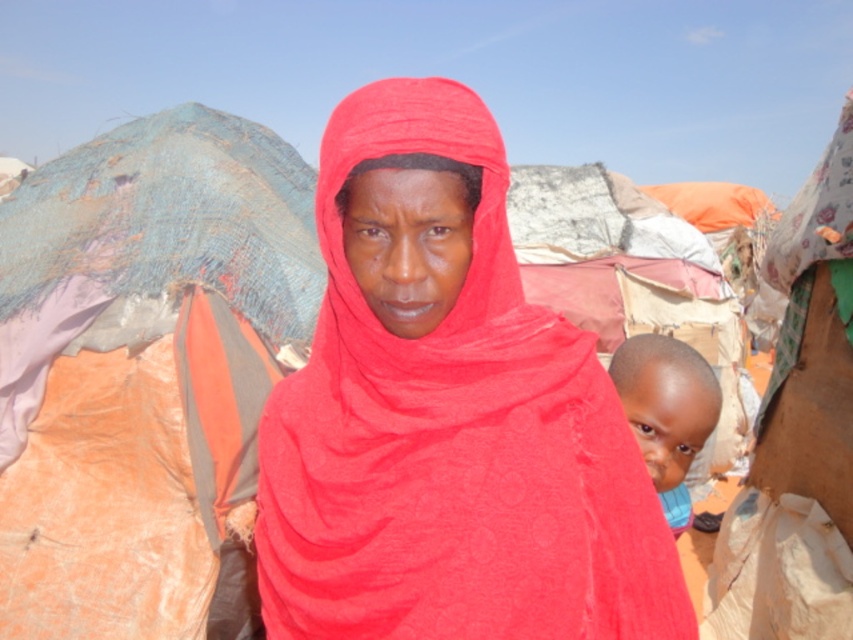
Question: Can you confirm if matte red scarf at center is positioned to the right of blue fabric at right?

Choices:
 (A) no
 (B) yes

Answer: (A)

Question: Can you confirm if matte red scarf at center is positioned to the left of blue fabric at right?

Choices:
 (A) no
 (B) yes

Answer: (B)

Question: Can you confirm if matte red scarf at center is wider than blue fabric at right?

Choices:
 (A) yes
 (B) no

Answer: (A)